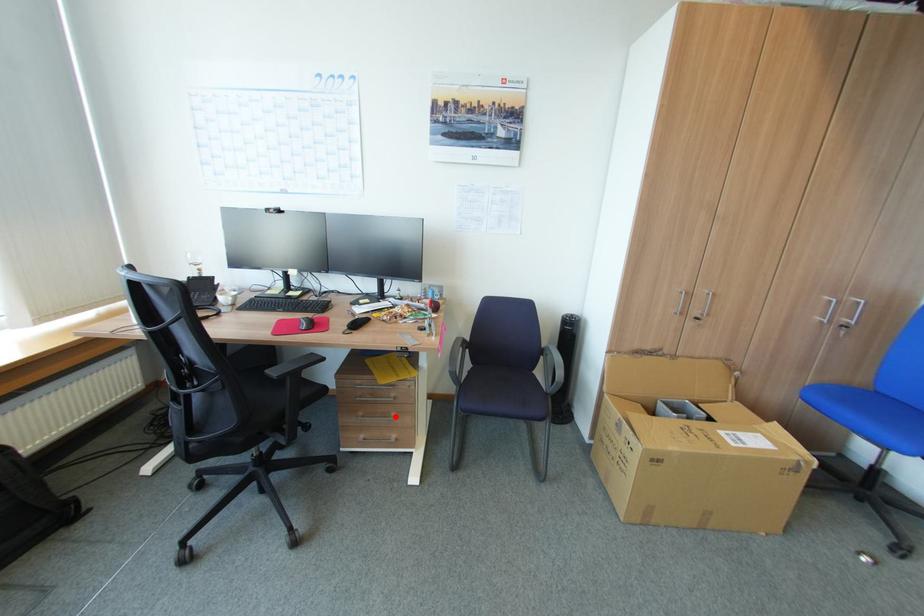
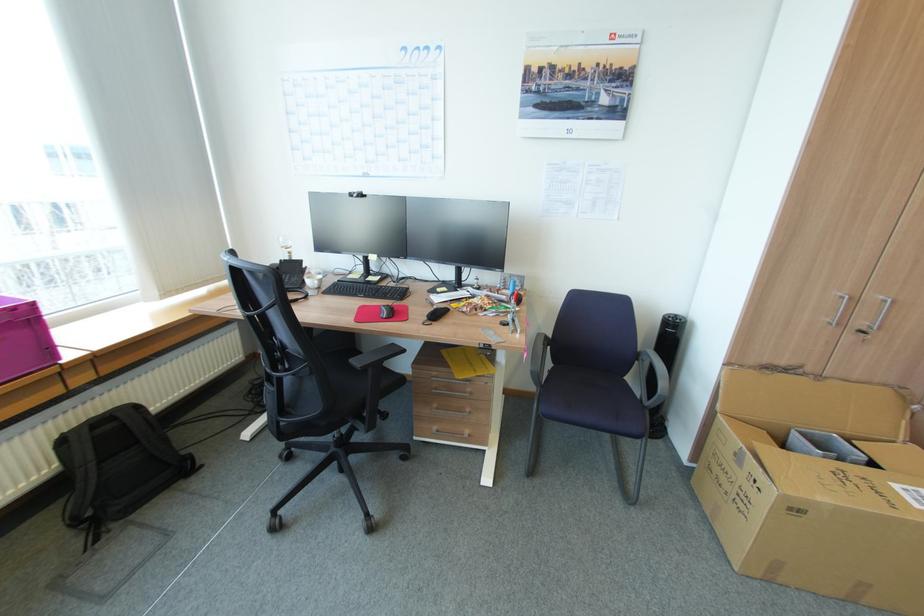
Question: I am providing you with two images of the same scene from different viewpoints. A red point is shown in image1. For the corresponding object point in image2, is it positioned nearer or farther from the camera?

Choices:
 (A) Nearer
 (B) Farther

Answer: (A)